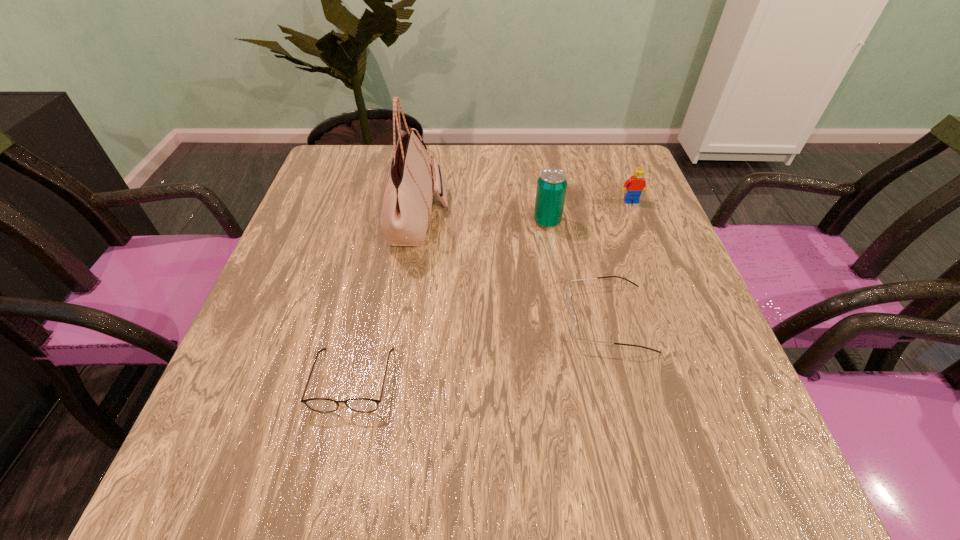
The width and height of the screenshot is (960, 540). What are the coordinates of `free space at the left edge of the desktop` in the screenshot? It's located at click(x=274, y=381).

Where is `free location at the far left corner`? This screenshot has height=540, width=960. free location at the far left corner is located at coordinates (372, 186).

I want to click on blank space at the near left corner of the desktop, so click(x=263, y=470).

This screenshot has height=540, width=960. In order to click on blank space at the far right corner of the desktop in this screenshot , I will do `click(621, 158)`.

Image resolution: width=960 pixels, height=540 pixels. Find the location of `vacant space that's between the fourth shortest object and the right spectacles`. vacant space that's between the fourth shortest object and the right spectacles is located at coordinates (577, 270).

Where is `vacant point located between the shortest object and the right spectacles`? The width and height of the screenshot is (960, 540). vacant point located between the shortest object and the right spectacles is located at coordinates (480, 349).

You are a GUI agent. You are given a task and a screenshot of the screen. Output one action in this format:
    pyautogui.click(x=<x>, y=<y>)
    Task: Click on the free point between the tallest object and the right spectacles
    
    Given the screenshot: What is the action you would take?
    pyautogui.click(x=513, y=268)

You are a GUI agent. You are given a task and a screenshot of the screen. Output one action in this format:
    pyautogui.click(x=<x>, y=<y>)
    Task: Click on the empty location between the right spectacles and the handbag
    Image resolution: width=960 pixels, height=540 pixels.
    Given the screenshot: What is the action you would take?
    pyautogui.click(x=513, y=268)

The height and width of the screenshot is (540, 960). I want to click on empty space between the left spectacles and the fourth shortest object, so click(450, 300).

This screenshot has height=540, width=960. Find the location of `free space between the shortest object and the second tallest object`. free space between the shortest object and the second tallest object is located at coordinates (450, 300).